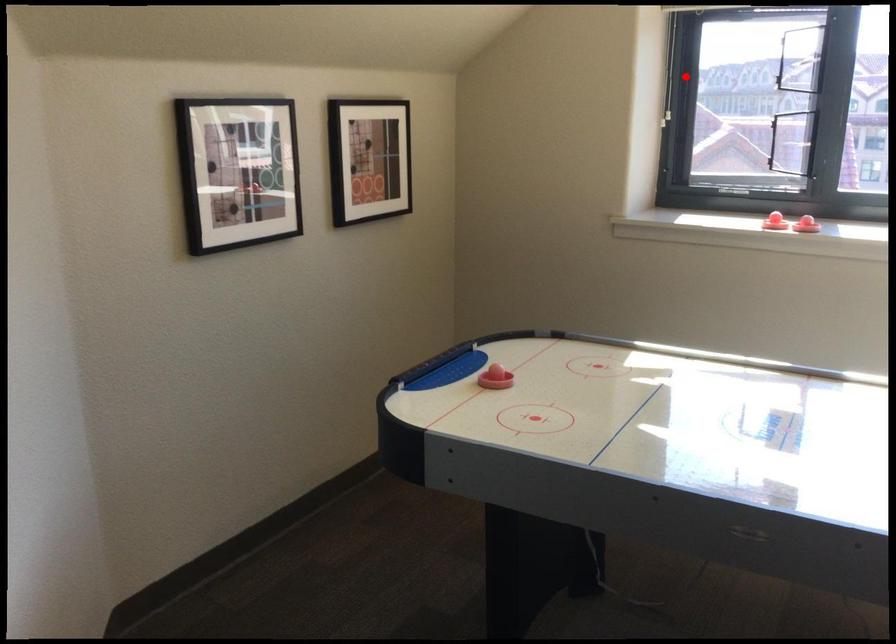
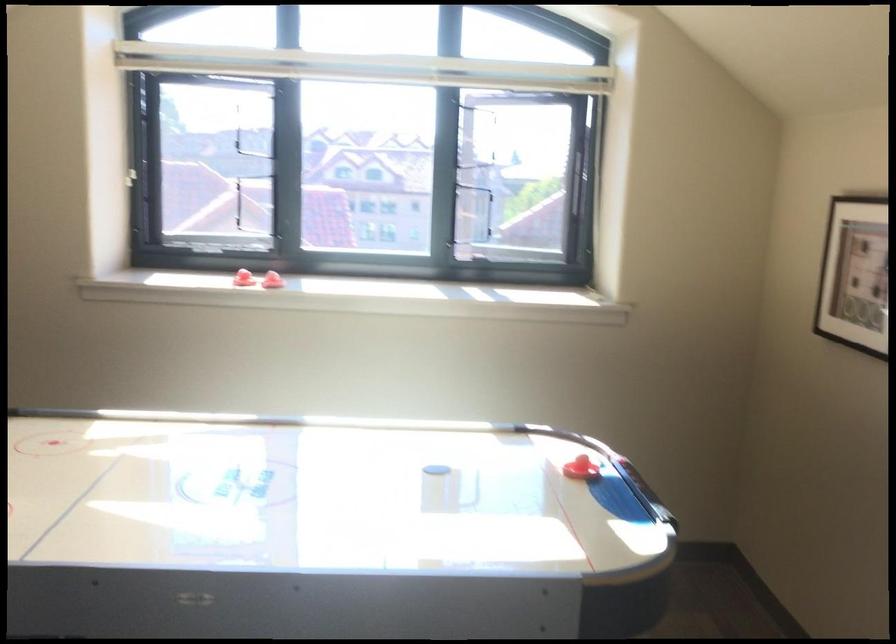
The point at the highlighted location is marked in the first image. Where is the corresponding point in the second image?

(143, 144)